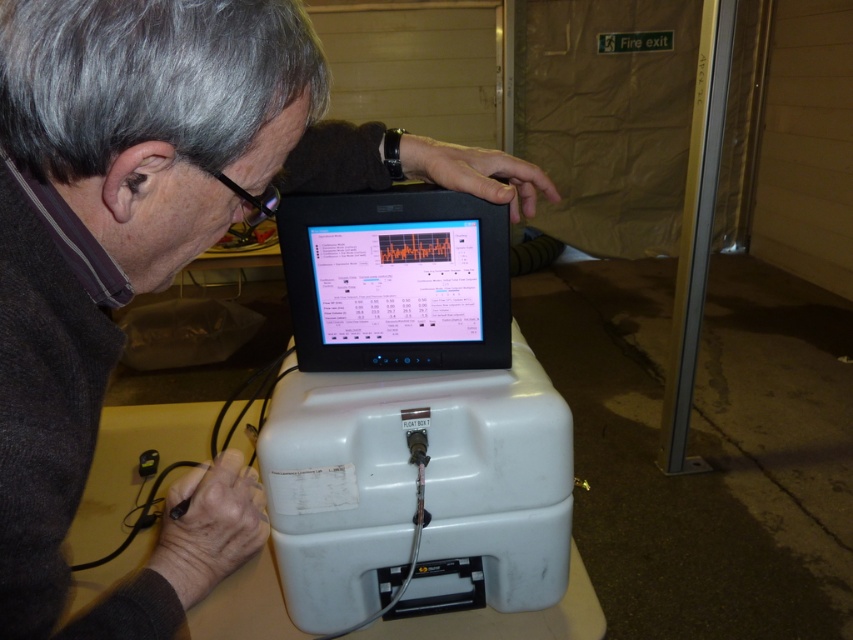
Find the location of a particular element. The height and width of the screenshot is (640, 853). matte black monitor at center is located at coordinates (134, 257).

Does point (198, 35) come behind point (358, 314)?

No, (198, 35) is in front of (358, 314).

Is point (207, 129) farther from viewer compared to point (486, 328)?

That is False.

The image size is (853, 640). I want to click on matte black monitor at center, so [x=134, y=257].